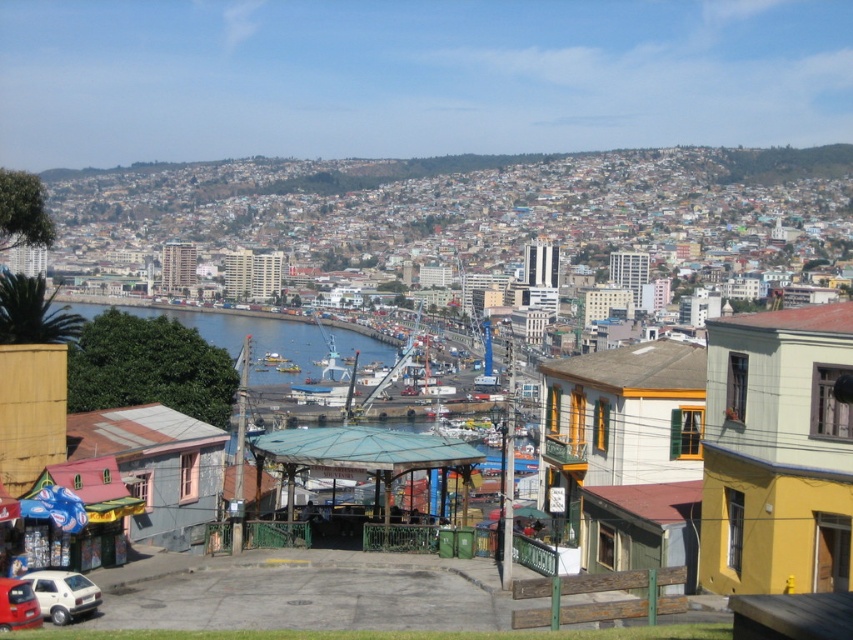
Between blue water at center and white matte car at lower left, which one appears on the left side from the viewer's perspective?

blue water at center is more to the left.

Who is positioned more to the right, blue water at center or white matte car at lower left?

white matte car at lower left is more to the right.

You are a GUI agent. You are given a task and a screenshot of the screen. Output one action in this format:
    pyautogui.click(x=<x>, y=<y>)
    Task: Click on the blue water at center
    
    Given the screenshot: What is the action you would take?
    pyautogui.click(x=254, y=339)

Does blue water at center lie in front of metallic red car at lower left?

No, it is behind metallic red car at lower left.

Is blue water at center above metallic red car at lower left?

Yes, blue water at center is above metallic red car at lower left.

Which is behind, point (238, 324) or point (10, 579)?

Positioned behind is point (238, 324).

What are the coordinates of `blue water at center` in the screenshot? It's located at tap(254, 339).

Which is more to the right, white matte car at lower left or metallic red car at lower left?

Positioned to the right is white matte car at lower left.

Is white matte car at lower left taller than metallic red car at lower left?

Incorrect, white matte car at lower left's height is not larger of metallic red car at lower left's.

Is point (85, 595) positioned behind point (26, 621)?

Yes.

I want to click on white matte car at lower left, so click(62, 595).